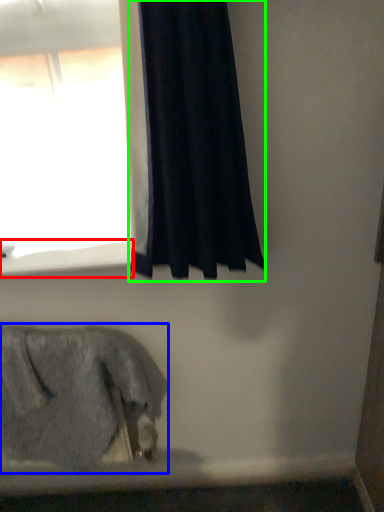
Question: Which is nearer to the window sill (highlighted by a red box)? animal (highlighted by a blue box) or curtain (highlighted by a green box).

Choices:
 (A) animal
 (B) curtain

Answer: (B)